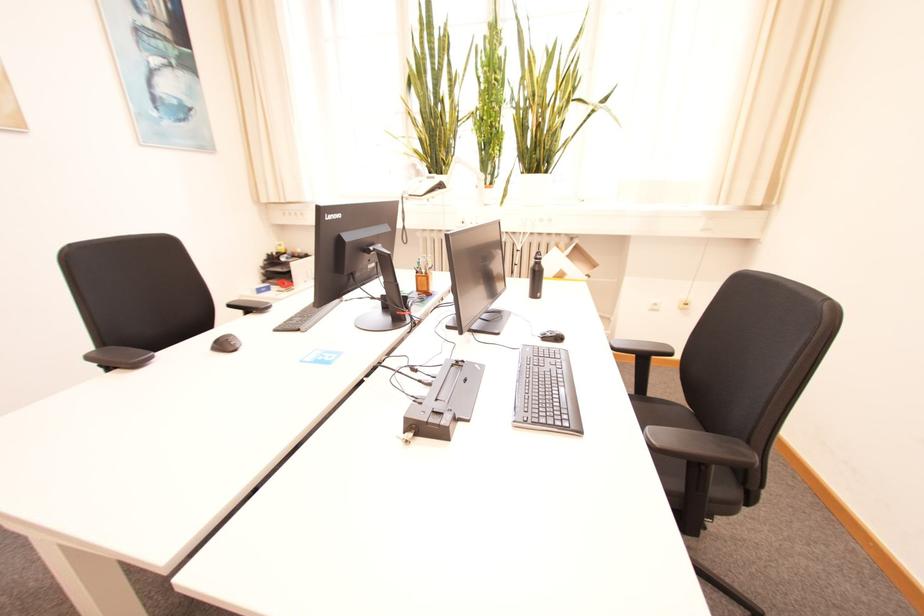
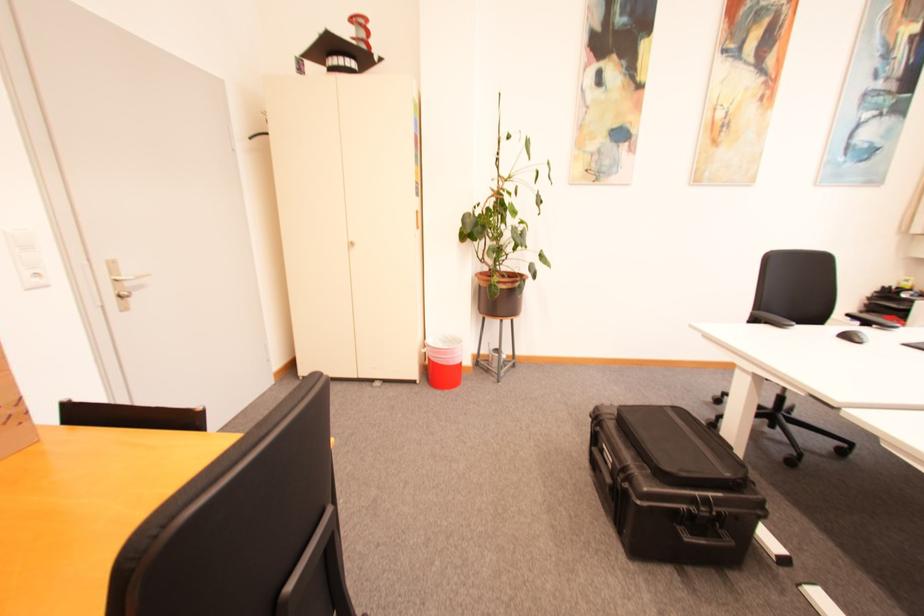
The point at (96, 359) is marked in the first image. Where is the corresponding point in the second image?

(759, 315)